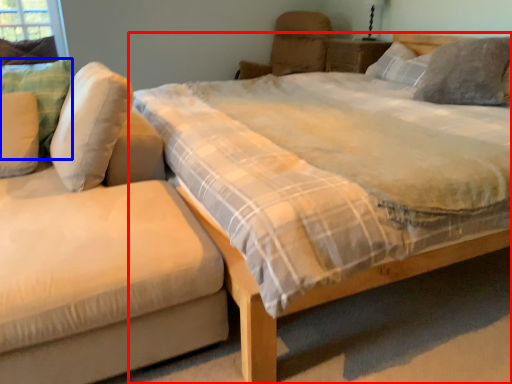
Question: Among these objects, which one is farthest to the camera, bed (highlighted by a red box) or pillow (highlighted by a blue box)?

Choices:
 (A) bed
 (B) pillow

Answer: (B)